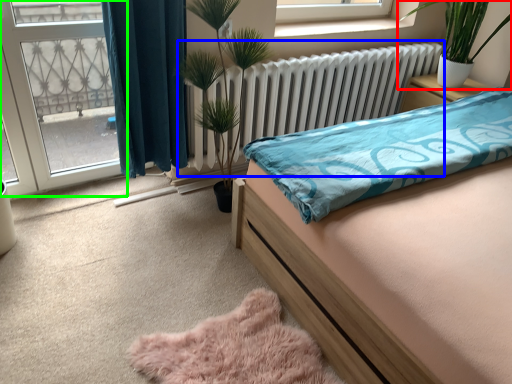
Question: Based on their relative distances, which object is nearer to houseplant (highlighted by a red box)? Choose from radiator (highlighted by a blue box) and glass door (highlighted by a green box).

Choices:
 (A) radiator
 (B) glass door

Answer: (A)